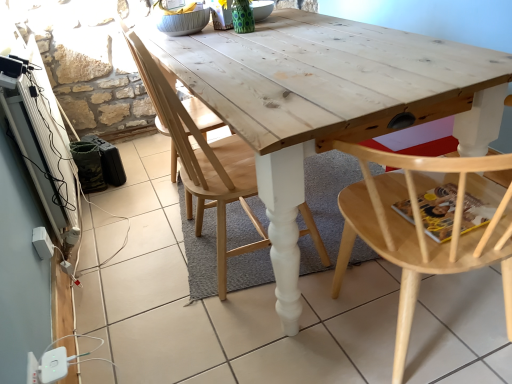
Identify the location of vacant space underneath natural wood chair at center, which appears as the 2th chair when viewed from the left (from a real-world perspective). The width and height of the screenshot is (512, 384). (237, 261).